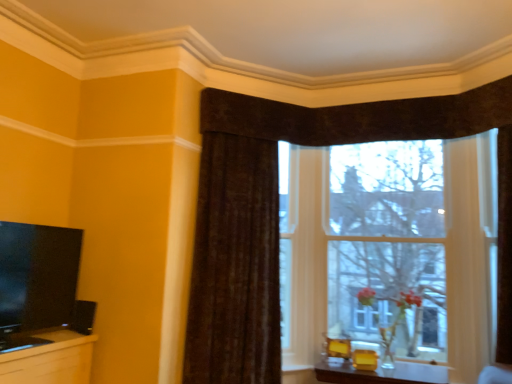
Question: From a real-world perspective, is matte yellow table at lower center physically above transparent glass window at center?

Choices:
 (A) yes
 (B) no

Answer: (B)

Question: Does matte yellow table at lower center appear on the left side of transparent glass window at center?

Choices:
 (A) no
 (B) yes

Answer: (B)

Question: Would you say matte yellow table at lower center is a long distance from transparent glass window at center?

Choices:
 (A) no
 (B) yes

Answer: (A)

Question: Does matte yellow table at lower center lie in front of transparent glass window at center?

Choices:
 (A) yes
 (B) no

Answer: (A)

Question: Can you confirm if matte yellow table at lower center is shorter than transparent glass window at center?

Choices:
 (A) no
 (B) yes

Answer: (B)

Question: From a real-world perspective, is transparent glass window at center physically located above or below matte black tv at left?

Choices:
 (A) above
 (B) below

Answer: (A)

Question: Relative to matte black tv at left, is transparent glass window at center in front or behind?

Choices:
 (A) front
 (B) behind

Answer: (B)

Question: Considering the positions of transparent glass window at center and matte black tv at left in the image, is transparent glass window at center wider or thinner than matte black tv at left?

Choices:
 (A) thin
 (B) wide

Answer: (B)

Question: Is transparent glass window at center spatially inside matte black tv at left, or outside of it?

Choices:
 (A) outside
 (B) inside

Answer: (A)

Question: Is matte black tv at left spatially inside transparent glass window at center, or outside of it?

Choices:
 (A) outside
 (B) inside

Answer: (A)

Question: Considering the positions of matte black tv at left and transparent glass window at center in the image, is matte black tv at left bigger or smaller than transparent glass window at center?

Choices:
 (A) small
 (B) big

Answer: (A)

Question: In the image, is matte black tv at left positioned in front of or behind transparent glass window at center?

Choices:
 (A) front
 (B) behind

Answer: (A)

Question: From the image's perspective, is matte black tv at left above or below transparent glass window at center?

Choices:
 (A) above
 (B) below

Answer: (B)

Question: Is matte yellow table at lower center to the left or to the right of brown textured curtain at upper center in the image?

Choices:
 (A) left
 (B) right

Answer: (B)

Question: From a real-world perspective, is matte yellow table at lower center physically located above or below brown textured curtain at upper center?

Choices:
 (A) above
 (B) below

Answer: (B)